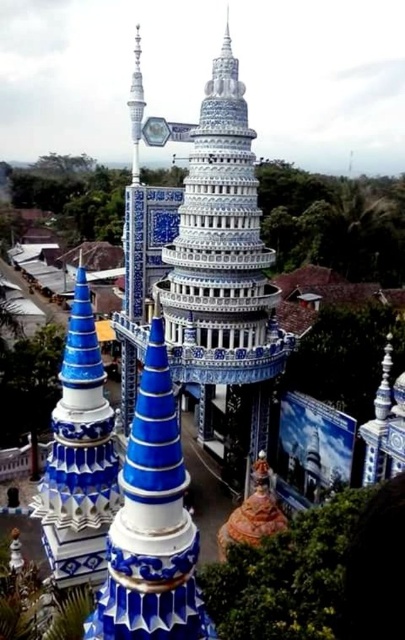
Question: Where is blue glossy tower at center located in relation to white glossy spire at upper center in the image?

Choices:
 (A) below
 (B) above

Answer: (A)

Question: Does blue glossy tower at center appear under white glossy spire at upper center?

Choices:
 (A) no
 (B) yes

Answer: (B)

Question: Which of the following is the closest to the observer?

Choices:
 (A) blue glossy tower at center
 (B) white glossy spire at upper center

Answer: (A)

Question: Among these points, which one is farthest from the camera?

Choices:
 (A) (134, 45)
 (B) (106, 412)

Answer: (A)

Question: Can you confirm if blue glossy tower at center is thinner than white glossy spire at upper center?

Choices:
 (A) no
 (B) yes

Answer: (B)